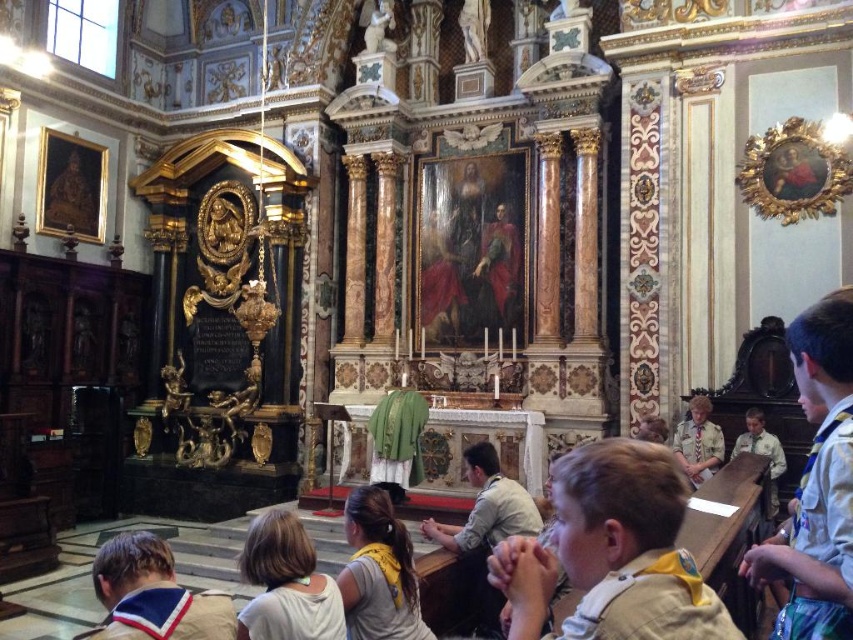
You are standing in the church and want to approach both the khaki uniform shirt at lower left and the gray fabric shirt at center. Which one should you move towards first to reach the one closer to you?

You should move towards the khaki uniform shirt at lower left first because it is closer to you than the gray fabric shirt at center.

You are a photographer standing at the altar in this church. You want to take a photo of the khaki uniform shirt at lower left and the gray fabric shirt at center so that both are in the frame. Given that your camera has a maximum focus range of 20 feet, will you be able to capture both subjects clearly in one shot?

The distance between the khaki uniform shirt at lower left and the gray fabric shirt at center is 19.60 feet, which is within the camera maximum focus range of 20 feet. Therefore, both subjects can be captured clearly in one shot.

You are standing in the grand church and want to take a photo of the altar. The camera you are using has a maximum focus range of 20 meters. Is the point at coordinates point [171,596] within the camera focus range?

The distance of point [171,596] from the camera is 20.65 meters, which exceeds the camera maximum focus range of 20 meters. Therefore, the camera cannot focus on that point.